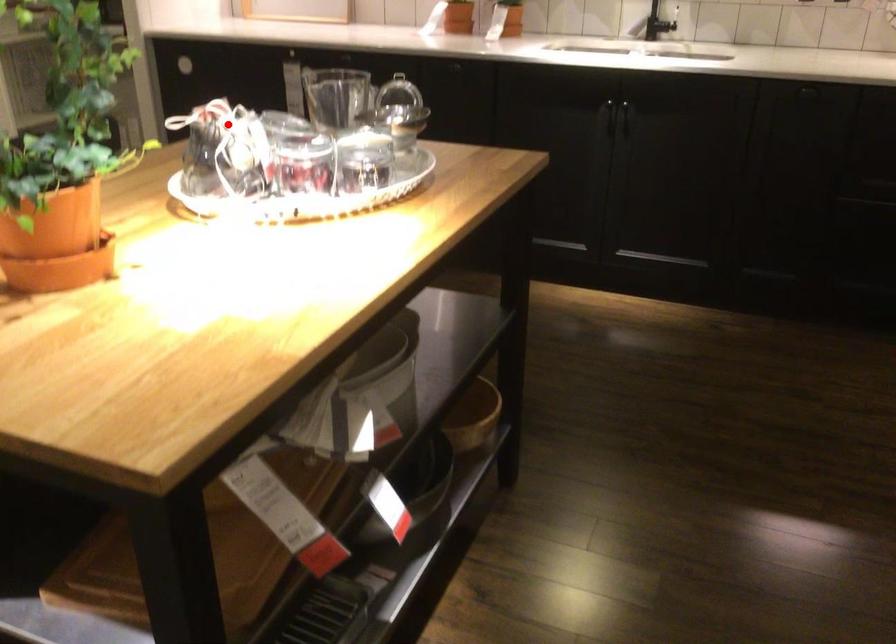
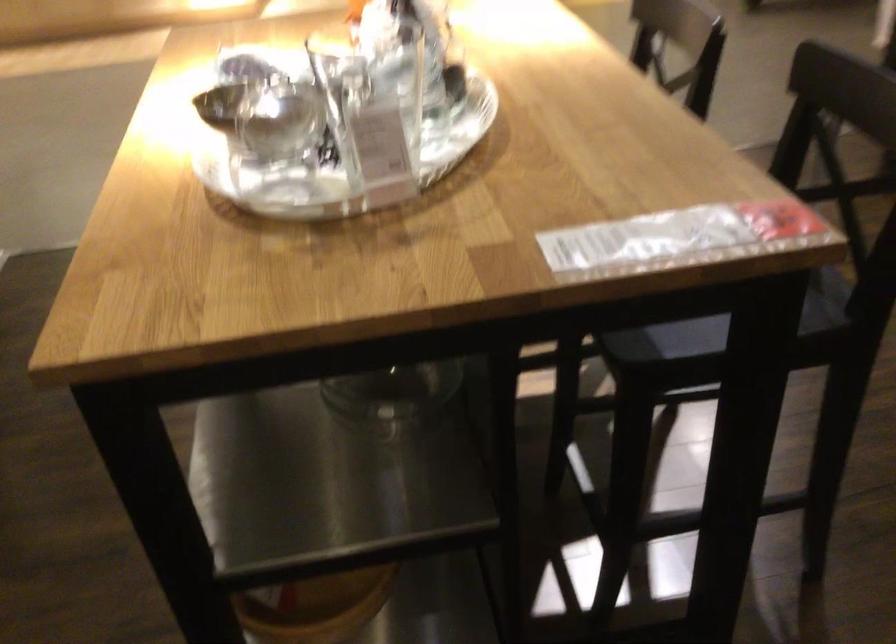
Question: I am providing you with two images of the same scene from different viewpoints. In image1, a red point is highlighted. Considering the same 3D point in image2, which of the following is correct?

Choices:
 (A) It is closer
 (B) It is farther

Answer: (A)